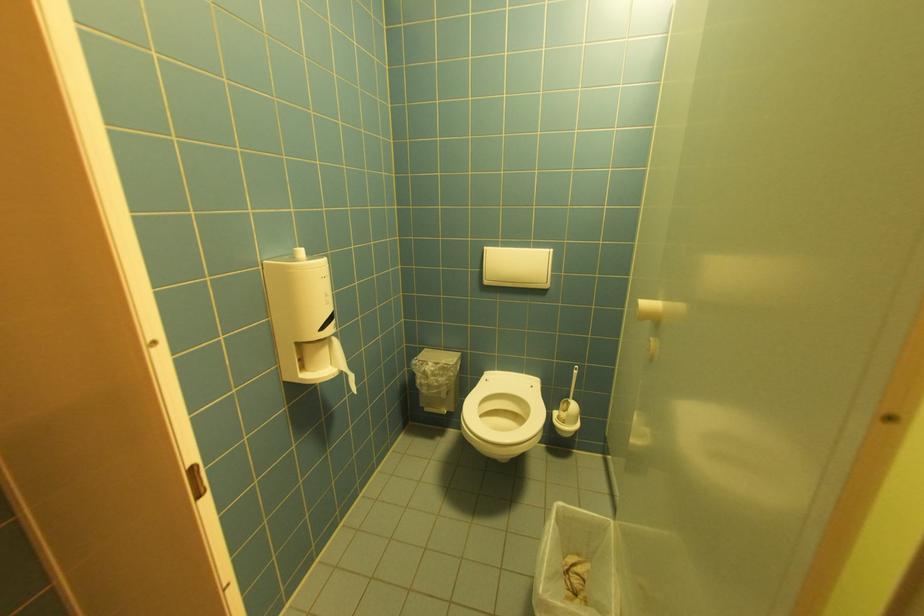
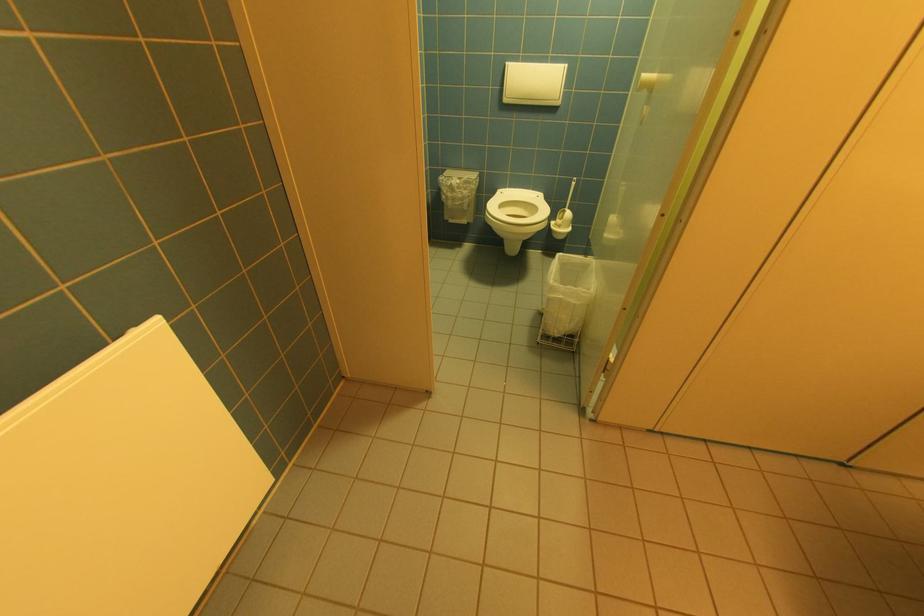
Locate, in the second image, the point that corresponds to point 572,406 in the first image.

(567, 215)